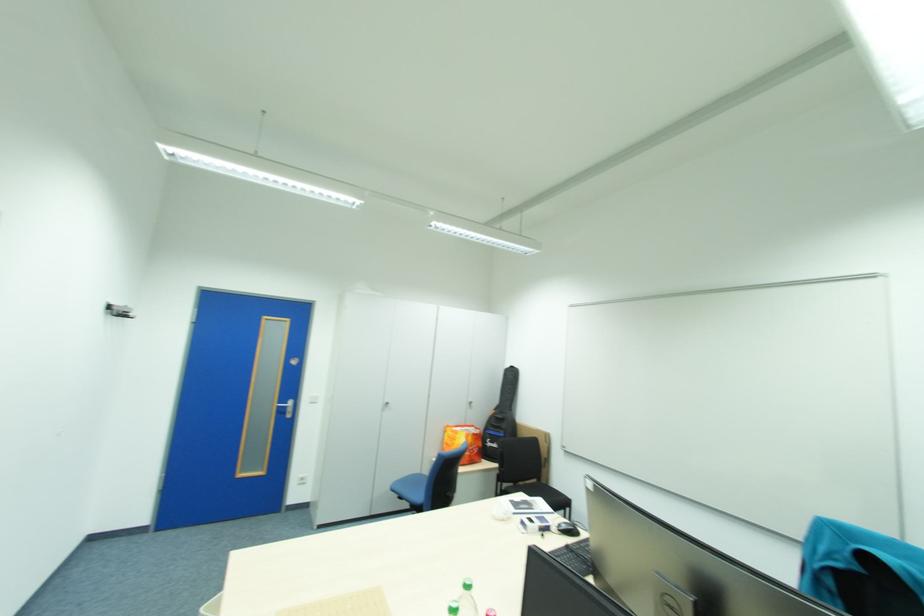
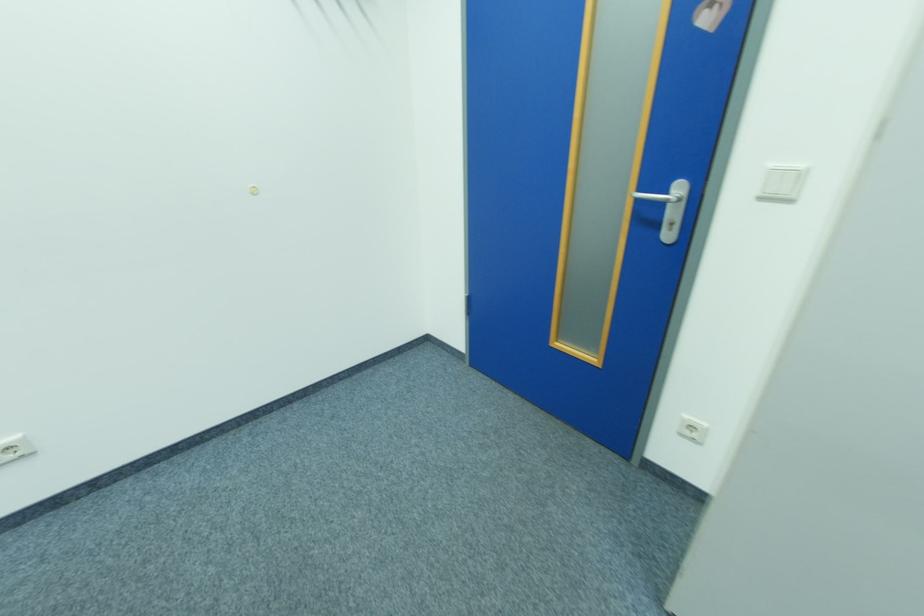
Locate, in the second image, the point that corresponds to (311,477) in the first image.

(702, 429)